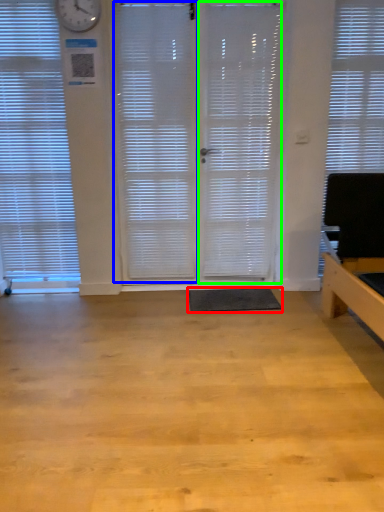
Question: Considering the real-world distances, which object is closest to flat (highlighted by a red box)? shutter (highlighted by a blue box) or screen door (highlighted by a green box).

Choices:
 (A) shutter
 (B) screen door

Answer: (B)